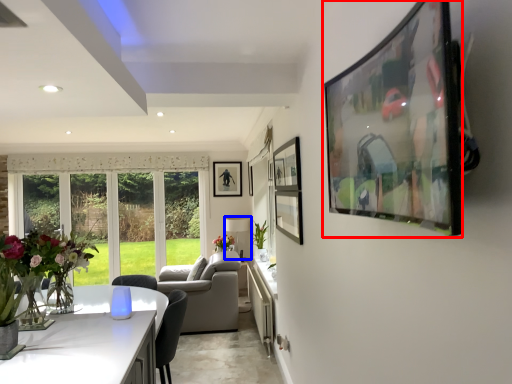
Question: Which object appears closest to the camera in this image, picture frame (highlighted by a red box) or lamp (highlighted by a blue box)?

Choices:
 (A) picture frame
 (B) lamp

Answer: (A)